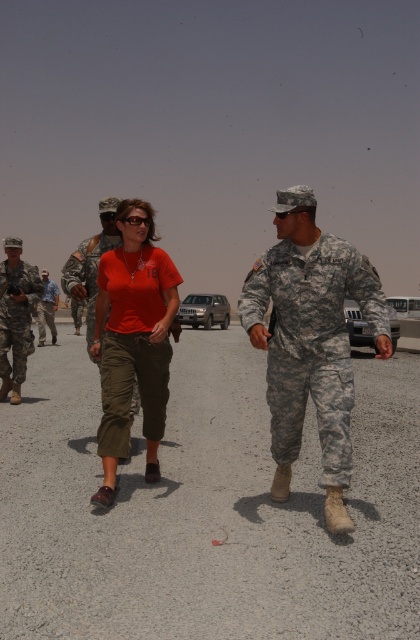
You are a photographer trying to capture both the camouflage uniform at center and the camouflage fabric uniform at center in a single shot. Which one should you focus on to ensure both are in sharp focus?

You should focus on the camouflage uniform at center because it is closer to the viewer, and focusing on the closer object increases the chances of both being in focus due to the depth of field.